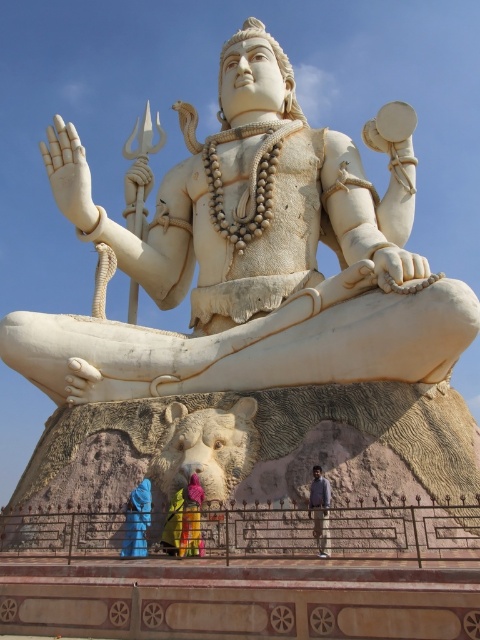
Question: Does blue fabric at lower left appear over multicolored fabric at lower center?

Choices:
 (A) yes
 (B) no

Answer: (A)

Question: Is multicolored fabric at lower center behind yellow fabric at center?

Choices:
 (A) no
 (B) yes

Answer: (A)

Question: Based on their relative distances, which object is nearer to the multicolored fabric at lower center?

Choices:
 (A) light brown pants at lower center
 (B) white marble statue at center
 (C) blue fabric at lower left
 (D) yellow fabric at center

Answer: (D)

Question: Is white marble statue at center below multicolored fabric at lower center?

Choices:
 (A) no
 (B) yes

Answer: (A)

Question: Which point is farther to the camera?

Choices:
 (A) (165, 532)
 (B) (146, 506)
 (C) (312, 472)

Answer: (B)

Question: Considering the real-world distances, which object is farthest from the yellow fabric at center?

Choices:
 (A) white marble statue at center
 (B) multicolored fabric at lower center
 (C) blue fabric at lower left

Answer: (A)